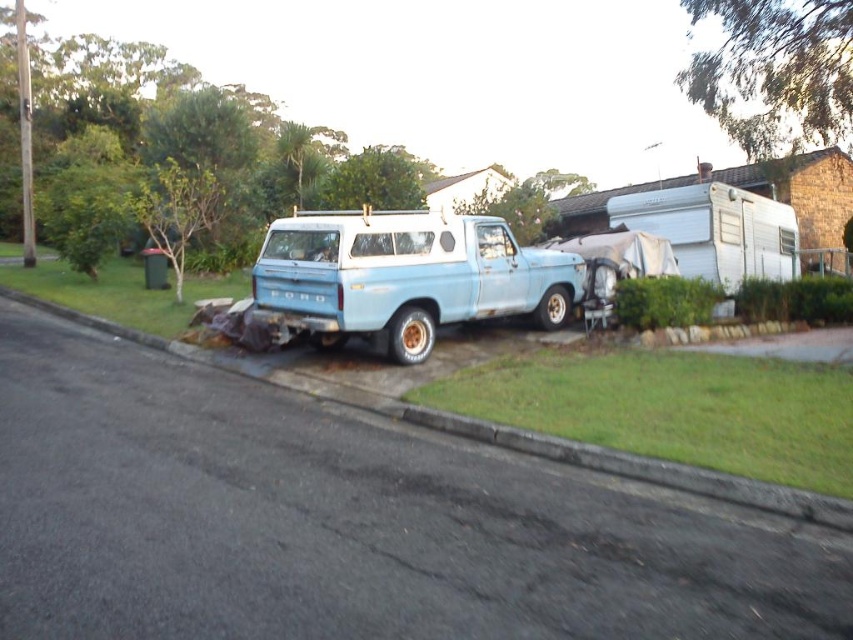
Who is higher up, light blue matte truck at center or white matte camper at upper right?

white matte camper at upper right

Is the position of light blue matte truck at center less distant than that of white matte camper at upper right?

That is True.

Does point (570, 298) lie behind point (692, 204)?

No, it is not.

You are a GUI agent. You are given a task and a screenshot of the screen. Output one action in this format:
    pyautogui.click(x=<x>, y=<y>)
    Task: Click on the light blue matte truck at center
    
    Given the screenshot: What is the action you would take?
    tap(404, 276)

Who is positioned more to the left, light blue matte truck at center or asphalt at lower center?

asphalt at lower center

Can you confirm if light blue matte truck at center is positioned below asphalt at lower center?

Incorrect, light blue matte truck at center is not positioned below asphalt at lower center.

Find the location of a particular element. This screenshot has width=853, height=640. light blue matte truck at center is located at coordinates (404, 276).

Can you confirm if asphalt at lower center is bigger than white matte camper at upper right?

Indeed, asphalt at lower center has a larger size compared to white matte camper at upper right.

Who is lower down, asphalt at lower center or white matte camper at upper right?

Positioned lower is asphalt at lower center.

Between point (549, 452) and point (689, 243), which one is positioned behind?

Point (689, 243)

Locate an element on the screen. asphalt at lower center is located at coordinates (491, 429).